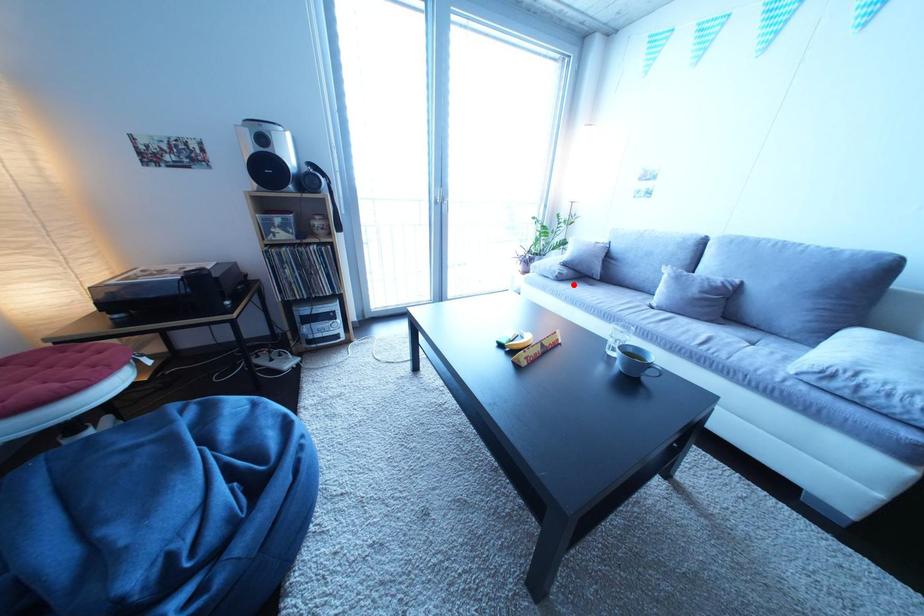
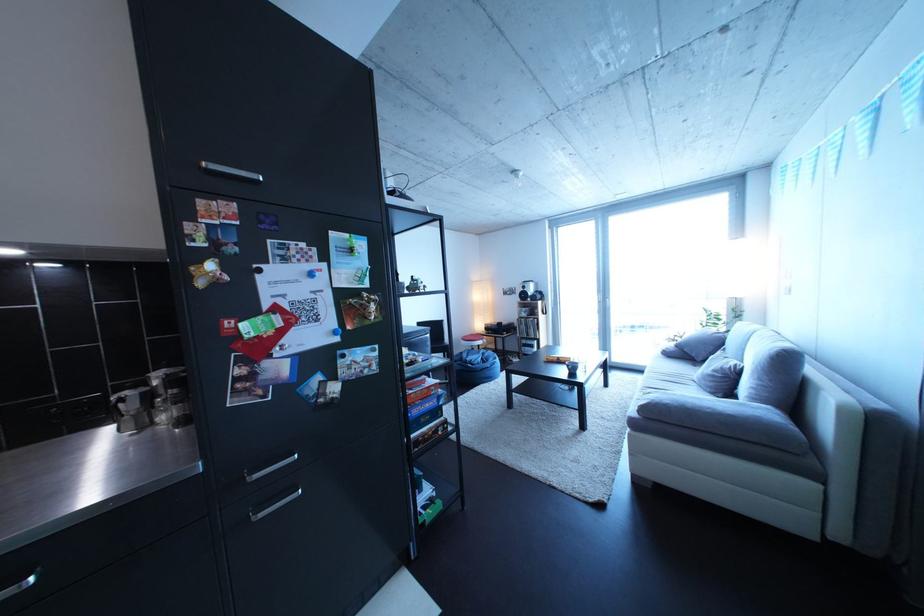
Question: I am providing you with two images of the same scene from different viewpoints. Given a red point in image1, look at the same physical point in image2. Is it:

Choices:
 (A) Closer to the viewpoint
 (B) Farther from the viewpoint

Answer: (B)